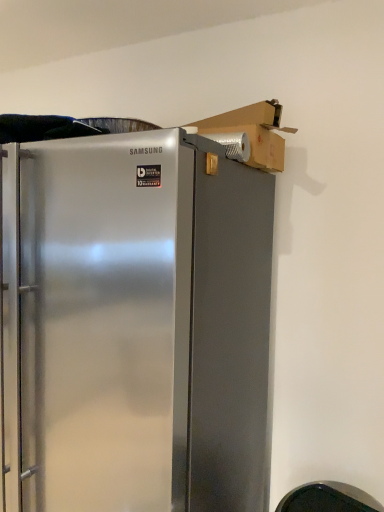
Question: From the image's perspective, is satin metallic refrigerator at center on cardboard box at upper right?

Choices:
 (A) no
 (B) yes

Answer: (A)

Question: Is there a large distance between satin metallic refrigerator at center and cardboard box at upper right?

Choices:
 (A) yes
 (B) no

Answer: (B)

Question: Is the position of satin metallic refrigerator at center more distant than that of cardboard box at upper right?

Choices:
 (A) no
 (B) yes

Answer: (A)

Question: From the image's perspective, is satin metallic refrigerator at center below cardboard box at upper right?

Choices:
 (A) no
 (B) yes

Answer: (B)

Question: Is satin metallic refrigerator at center turned away from cardboard box at upper right?

Choices:
 (A) yes
 (B) no

Answer: (B)

Question: Is satin metallic refrigerator at center completely or partially outside of cardboard box at upper right?

Choices:
 (A) no
 (B) yes

Answer: (B)

Question: Can you see cardboard box at upper right touching satin metallic refrigerator at center?

Choices:
 (A) no
 (B) yes

Answer: (A)

Question: Is cardboard box at upper right taller than satin metallic refrigerator at center?

Choices:
 (A) yes
 (B) no

Answer: (B)

Question: From the image's perspective, is cardboard box at upper right beneath satin metallic refrigerator at center?

Choices:
 (A) no
 (B) yes

Answer: (A)

Question: Considering the relative sizes of cardboard box at upper right and satin metallic refrigerator at center in the image provided, is cardboard box at upper right shorter than satin metallic refrigerator at center?

Choices:
 (A) no
 (B) yes

Answer: (B)

Question: From the image's perspective, does cardboard box at upper right appear higher than satin metallic refrigerator at center?

Choices:
 (A) yes
 (B) no

Answer: (A)

Question: Does cardboard box at upper right come in front of satin metallic refrigerator at center?

Choices:
 (A) no
 (B) yes

Answer: (A)

Question: From the image's perspective, is cardboard box at upper right located above or below satin metallic refrigerator at center?

Choices:
 (A) below
 (B) above

Answer: (B)